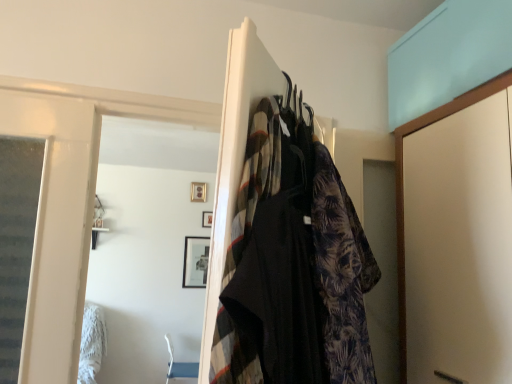
Question: Is printed fabric dress at center taller or shorter than printed fabric robe at center?

Choices:
 (A) short
 (B) tall

Answer: (A)

Question: From the image's perspective, is printed fabric dress at center located above or below printed fabric robe at center?

Choices:
 (A) below
 (B) above

Answer: (B)

Question: Looking at the image, does printed fabric dress at center seem bigger or smaller compared to printed fabric robe at center?

Choices:
 (A) small
 (B) big

Answer: (B)

Question: From a real-world perspective, relative to printed fabric dress at center, is printed fabric robe at center vertically above or below?

Choices:
 (A) above
 (B) below

Answer: (B)

Question: From the image's perspective, is printed fabric robe at center positioned above or below printed fabric dress at center?

Choices:
 (A) above
 (B) below

Answer: (B)

Question: Is printed fabric robe at center situated inside printed fabric dress at center or outside?

Choices:
 (A) inside
 (B) outside

Answer: (B)

Question: In terms of width, does printed fabric robe at center look wider or thinner when compared to printed fabric dress at center?

Choices:
 (A) thin
 (B) wide

Answer: (A)